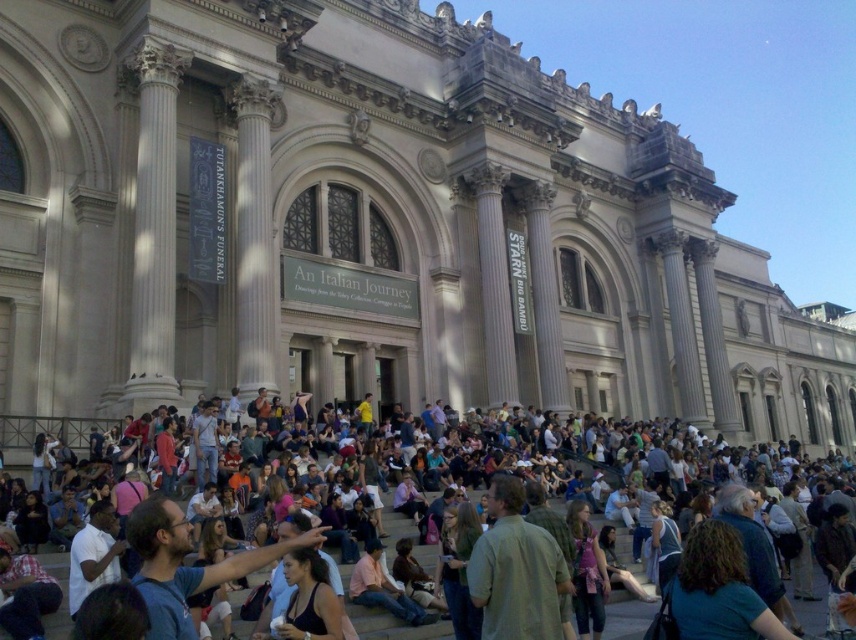
You are standing in front of the grand neoclassical building and see a point marked at coordinates (718, 589). Based on the scene description, can you determine what object or feature this point corresponds to?

The point at coordinates (718, 589) corresponds to the dark blue shirt at lower right.

You are standing in front of the grand neoclassical building and notice a crowd wearing multicolored casual attire at center. If you want to take a photo of the building without anyone in the frame, which direction should you move to avoid the crowd?

The multicolored casual attire at center is located at point [462,464], so moving to the left or right would help avoid the crowd in the center for a clear photo of the building.

You are standing in front of the grand neoclassical building and notice two people in the crowd. One is wearing multicolored casual attire at center and the other is wearing green textured jacket at center. From your perspective, which person is positioned to the right of the other?

The multicolored casual attire at center is to the right of green textured jacket at center, so the person in multicolored casual attire at center is positioned to the right of the person in green textured jacket at center.